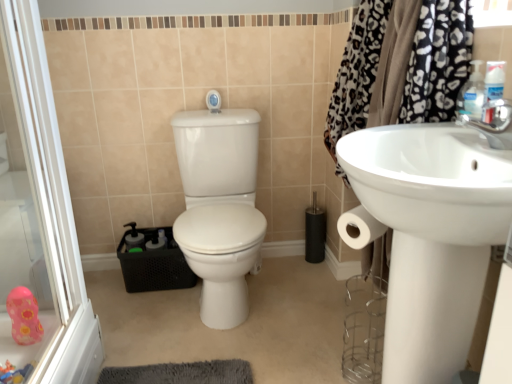
Question: Is white glossy sink at right positioned in front of pink rubber duck at lower left, the first toy viewed from the top?

Choices:
 (A) no
 (B) yes

Answer: (B)

Question: From the image's perspective, is white glossy sink at right located beneath pink rubber duck at lower left, the first toy viewed from the top?

Choices:
 (A) no
 (B) yes

Answer: (A)

Question: Is white glossy sink at right facing away from pink rubber duck at lower left, the first toy viewed from the top?

Choices:
 (A) yes
 (B) no

Answer: (B)

Question: Is the position of white glossy sink at right more distant than that of pink rubber duck at lower left, marked as the second toy in a bottom-to-top arrangement?

Choices:
 (A) no
 (B) yes

Answer: (A)

Question: Is white glossy sink at right facing towards pink rubber duck at lower left, marked as the second toy in a bottom-to-top arrangement?

Choices:
 (A) yes
 (B) no

Answer: (A)

Question: Looking at the image, does pink rubber duck at lower left, the first toy viewed from the top, seem bigger or smaller compared to white glossy sink at right?

Choices:
 (A) small
 (B) big

Answer: (A)

Question: From a real-world perspective, is pink rubber duck at lower left, marked as the second toy in a bottom-to-top arrangement, above or below white glossy sink at right?

Choices:
 (A) above
 (B) below

Answer: (B)

Question: In terms of height, does pink rubber duck at lower left, marked as the second toy in a bottom-to-top arrangement, look taller or shorter compared to white glossy sink at right?

Choices:
 (A) short
 (B) tall

Answer: (A)

Question: Is point [31, 297] positioned closer to the camera than point [419, 268]?

Choices:
 (A) closer
 (B) farther

Answer: (B)

Question: In terms of height, does white glossy toilet at center look taller or shorter compared to black leopard print fabric at upper right?

Choices:
 (A) short
 (B) tall

Answer: (A)

Question: Is white glossy toilet at center inside or outside of black leopard print fabric at upper right?

Choices:
 (A) inside
 (B) outside

Answer: (B)

Question: Considering the positions of white glossy toilet at center and black leopard print fabric at upper right in the image, is white glossy toilet at center bigger or smaller than black leopard print fabric at upper right?

Choices:
 (A) small
 (B) big

Answer: (B)

Question: From a real-world perspective, relative to black leopard print fabric at upper right, is white glossy toilet at center vertically above or below?

Choices:
 (A) above
 (B) below

Answer: (B)

Question: Considering the positions of point (17, 326) and point (271, 347), is point (17, 326) closer or farther from the camera than point (271, 347)?

Choices:
 (A) farther
 (B) closer

Answer: (B)

Question: Considering the positions of pink rubber duck at lower left, the first toy viewed from the top, and pink rubber duck at lower left in the image, is pink rubber duck at lower left, the first toy viewed from the top, taller or shorter than pink rubber duck at lower left?

Choices:
 (A) short
 (B) tall

Answer: (B)